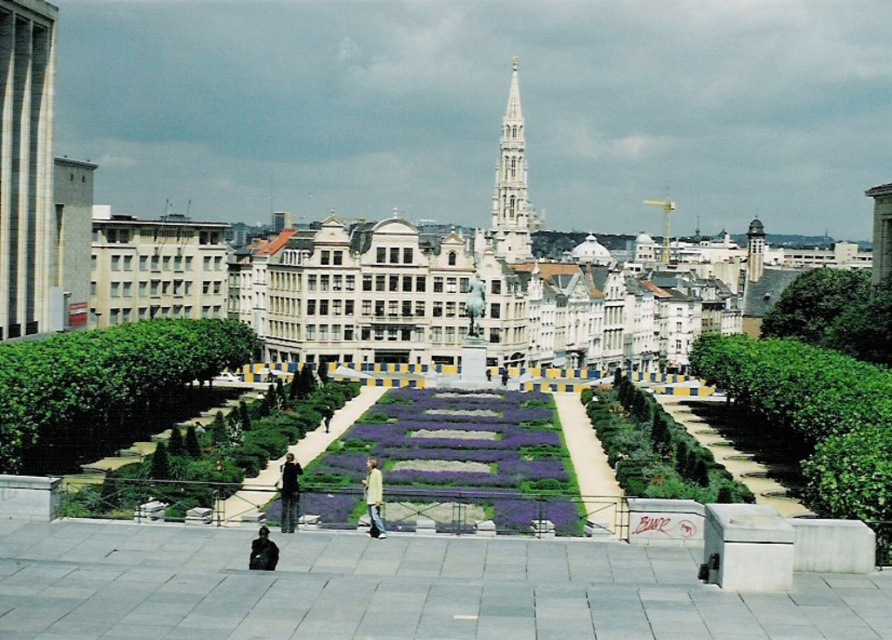
You are standing on the rooftop where the image was taken and want to take a photo of the white textured tower at left. Given that the tower is at coordinates approximately 0.256 on the x and 0.029 on the y axis, would it be positioned more towards the left or right side of your camera frame?

The white textured tower at left is located at point 0.256 on the x axis and 0.029 on the y axis. Since the x coordinate is closer to 0, it is positioned more towards the left side of the camera frame.

In the scene shown: You are a drone operator tasked with flying a drone from the white textured tower at left to the white marble spire at center. The drone has a maximum range of 120 meters. Can you safely reach the spire from the tower without exceeding the drone range?

The white textured tower at left is 120.85 meters from the white marble spire at center. Since the distance exceeds the drone range of 120 meters, the drone cannot safely reach the spire without exceeding its maximum range.